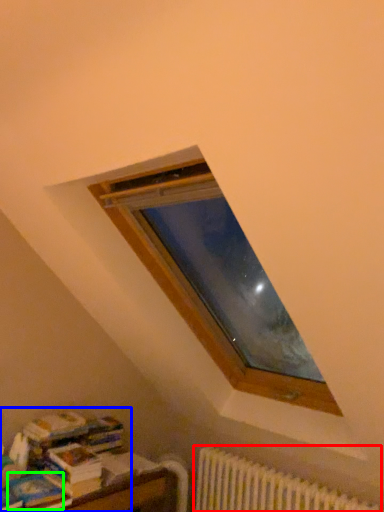
Question: Estimate the real-world distances between objects in this image. Which object is farther from radiator (highlighted by a red box), book (highlighted by a blue box) or paperback book (highlighted by a green box)?

Choices:
 (A) book
 (B) paperback book

Answer: (B)